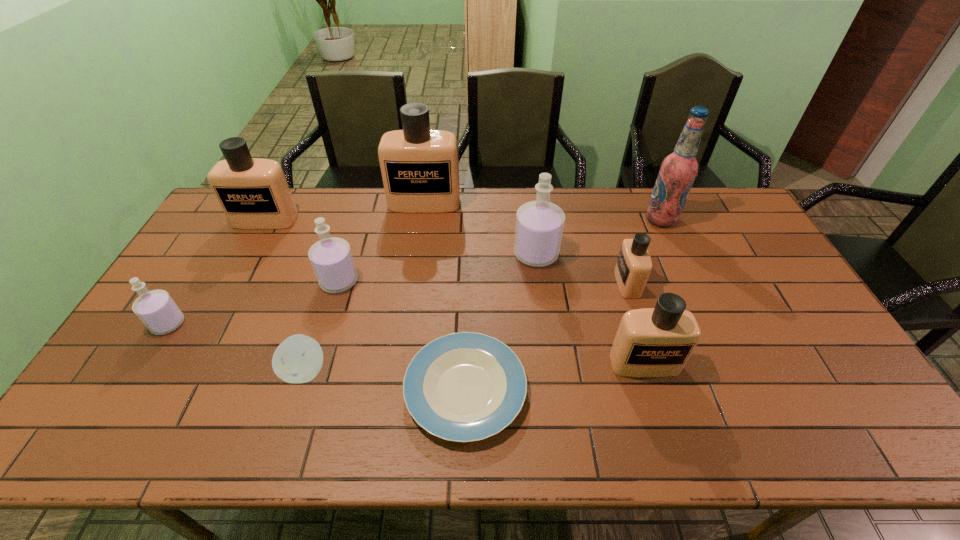
At what (x,y) coordinates should I click in order to perform the action: click on vacant space in between the apple and the second beige perfume from left to right. Please return your answer as a coordinate pair (x, y). Looking at the image, I should click on click(x=365, y=287).

You are a GUI agent. You are given a task and a screenshot of the screen. Output one action in this format:
    pyautogui.click(x=<x>, y=<y>)
    Task: Click on the free space between the second shortest object and the blue alcohol
    The height and width of the screenshot is (540, 960).
    Given the screenshot: What is the action you would take?
    pyautogui.click(x=483, y=295)

Where is `vacant region between the nearest perfume and the third perfume from right to left`? The height and width of the screenshot is (540, 960). vacant region between the nearest perfume and the third perfume from right to left is located at coordinates (590, 309).

Where is `vacant point located between the fifth perfume from left to right and the smallest purple perfume`? This screenshot has width=960, height=540. vacant point located between the fifth perfume from left to right and the smallest purple perfume is located at coordinates (352, 289).

The image size is (960, 540). Find the location of `free space between the apple and the third farthest beige perfume`. free space between the apple and the third farthest beige perfume is located at coordinates (467, 327).

The width and height of the screenshot is (960, 540). In order to click on blank region between the rightmost object and the third biggest beige perfume in this screenshot , I will do `click(653, 291)`.

The image size is (960, 540). Identify the location of vacant point located between the second smallest purple perfume and the biggest beige perfume. (382, 242).

Identify the location of object that is the fourth closest to the seventh farthest object. The height and width of the screenshot is (540, 960). (463, 387).

I want to click on object identified as the fourth closest to the biggest beige perfume, so click(x=463, y=387).

This screenshot has width=960, height=540. What are the coordinates of `perfume object that ranks as the fifth closest to the apple` in the screenshot? It's located at (420, 169).